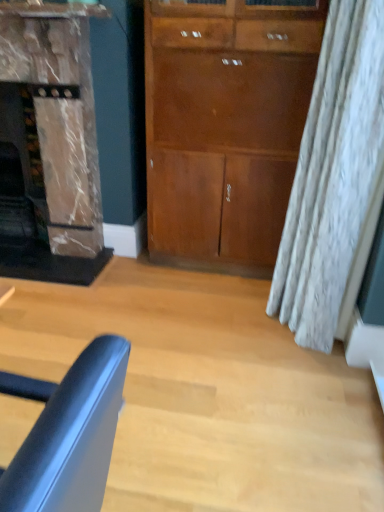
Describe the element at coordinates (51, 143) in the screenshot. I see `matte brown fireplace at left` at that location.

Describe the element at coordinates (225, 128) in the screenshot. The height and width of the screenshot is (512, 384). I see `matte wood cabinet at center` at that location.

Describe the element at coordinates (71, 437) in the screenshot. Image resolution: width=384 pixels, height=512 pixels. I see `matte blue chair at lower left` at that location.

The height and width of the screenshot is (512, 384). I want to click on matte brown fireplace at left, so click(51, 143).

Image resolution: width=384 pixels, height=512 pixels. I want to click on fireplace directly beneath the matte wood cabinet at center (from a real-world perspective), so click(51, 143).

From the image's perspective, which one is positioned lower, matte wood cabinet at center or matte brown fireplace at left?

matte wood cabinet at center is shown below in the image.

Are matte wood cabinet at center and matte brown fireplace at left located far from each other?

No.

How different are the orientations of matte blue chair at lower left and matte brown fireplace at left in degrees?

The facing directions of matte blue chair at lower left and matte brown fireplace at left are 88.4 degrees apart.

Is matte blue chair at lower left spatially inside matte brown fireplace at left, or outside of it?

matte blue chair at lower left lies outside matte brown fireplace at left.

Considering the relative positions of matte blue chair at lower left and matte brown fireplace at left in the image provided, is matte blue chair at lower left behind matte brown fireplace at left?

No, it is not.

Considering the positions of point (104, 401) and point (31, 125), is point (104, 401) closer or farther from the camera than point (31, 125)?

Clearly, point (104, 401) is closer to the camera than point (31, 125).

You are a GUI agent. You are given a task and a screenshot of the screen. Output one action in this format:
    pyautogui.click(x=<x>, y=<y>)
    Task: Click on the fireplace behind the matte blue chair at lower left
    This screenshot has height=512, width=384.
    Given the screenshot: What is the action you would take?
    pyautogui.click(x=51, y=143)

Which of these two, matte brown fireplace at left or matte blue chair at lower left, stands shorter?

With less height is matte blue chair at lower left.

From the image's perspective, between matte brown fireplace at left and matte blue chair at lower left, who is located below?

matte blue chair at lower left.

You are a GUI agent. You are given a task and a screenshot of the screen. Output one action in this format:
    pyautogui.click(x=<x>, y=<y>)
    Task: Click on the fireplace below the matte wood cabinet at center (from a real-world perspective)
    Image resolution: width=384 pixels, height=512 pixels.
    Given the screenshot: What is the action you would take?
    pyautogui.click(x=51, y=143)

From the picture: Is matte brown fireplace at left further to camera compared to matte wood cabinet at center?

Yes, it is.

Looking at this image, is matte brown fireplace at left looking in the opposite direction of matte wood cabinet at center?

matte brown fireplace at left is not turned away from matte wood cabinet at center.

Is matte brown fireplace at left positioned far away from matte wood cabinet at center?

No, matte brown fireplace at left is not far away from matte wood cabinet at center.

Considering the relative sizes of matte wood cabinet at center and matte blue chair at lower left in the image provided, is matte wood cabinet at center taller than matte blue chair at lower left?

Indeed, matte wood cabinet at center has a greater height compared to matte blue chair at lower left.

Is matte wood cabinet at center positioned far away from matte blue chair at lower left?

matte wood cabinet at center is positioned a significant distance from matte blue chair at lower left.

The width and height of the screenshot is (384, 512). Find the location of `chair that is under the matte wood cabinet at center (from a real-world perspective)`. chair that is under the matte wood cabinet at center (from a real-world perspective) is located at coordinates (71, 437).

Is matte wood cabinet at center further to the viewer compared to matte blue chair at lower left?

Yes, matte wood cabinet at center is further from the viewer.

Is point (92, 505) more distant than point (268, 205)?

No, it is not.

Based on their positions, is matte blue chair at lower left located to the left or right of matte wood cabinet at center?

From the image, it's evident that matte blue chair at lower left is to the left of matte wood cabinet at center.

Considering the relative sizes of matte blue chair at lower left and matte wood cabinet at center in the image provided, is matte blue chair at lower left thinner than matte wood cabinet at center?

Yes.

Where is `fireplace behind the matte wood cabinet at center`? The height and width of the screenshot is (512, 384). fireplace behind the matte wood cabinet at center is located at coordinates (51, 143).

This screenshot has height=512, width=384. What are the coordinates of `chair located on the right of matte brown fireplace at left` in the screenshot? It's located at (71, 437).

Estimate the real-world distances between objects in this image. Which object is closer to matte blue chair at lower left, matte wood cabinet at center or matte brown fireplace at left?

matte wood cabinet at center is positioned closer to the anchor matte blue chair at lower left.

Looking at this image, estimate the real-world distances between objects in this image. Which object is closer to matte wood cabinet at center, matte brown fireplace at left or matte blue chair at lower left?

matte brown fireplace at left is closer to matte wood cabinet at center.

From the image, which object appears to be nearer to matte blue chair at lower left, matte brown fireplace at left or matte wood cabinet at center?

Based on the image, matte wood cabinet at center appears to be nearer to matte blue chair at lower left.

Based on their spatial positions, is matte wood cabinet at center or matte blue chair at lower left further from matte brown fireplace at left?

The object further to matte brown fireplace at left is matte blue chair at lower left.

Looking at the image, which one is located closer to matte brown fireplace at left, matte blue chair at lower left or matte wood cabinet at center?

matte wood cabinet at center lies closer to matte brown fireplace at left than the other object.

Considering their positions, is matte blue chair at lower left positioned further to matte wood cabinet at center than matte brown fireplace at left?

matte blue chair at lower left lies further to matte wood cabinet at center than the other object.

The image size is (384, 512). I want to click on cabinetry between matte blue chair at lower left and matte brown fireplace at left from front to back, so click(225, 128).